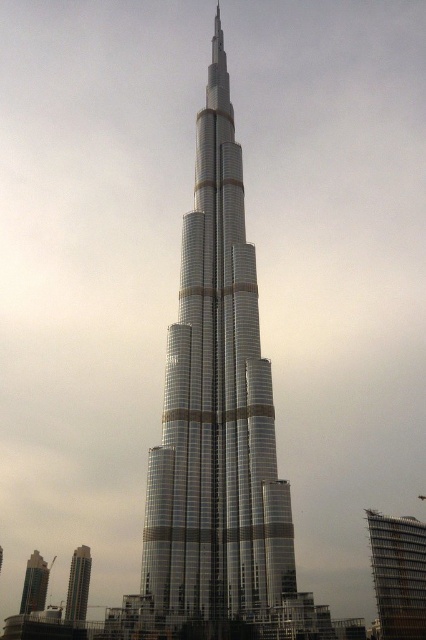
You are standing at the center of the image and want to locate the silver metallic building at lower left. In which direction should you look to find it?

The silver metallic building at lower left is located at point (x=77, y=586), so you should look to the lower left direction to find it.

You are a drone operator planning to fly a drone between the glassy metallic skyscraper at center and the silver metallic building at lower left. Based on the scene, can you determine if the space between them is wide enough for your drone to pass through safely?

The glassy metallic skyscraper at center might be wider than silver metallic building at lower left, so the space between them may not be wide enough for the drone to pass safely. Further measurements are needed.

You are standing in Dubai and see the Burj Khalifa. You notice two structures at the lower left of your view. One is the silver metallic building at lower left and the other is the metallic glass skyscraper at lower left. Which of these two structures is closer to you?

The silver metallic building at lower left is closer to you because it is in front of the metallic glass skyscraper at lower left.